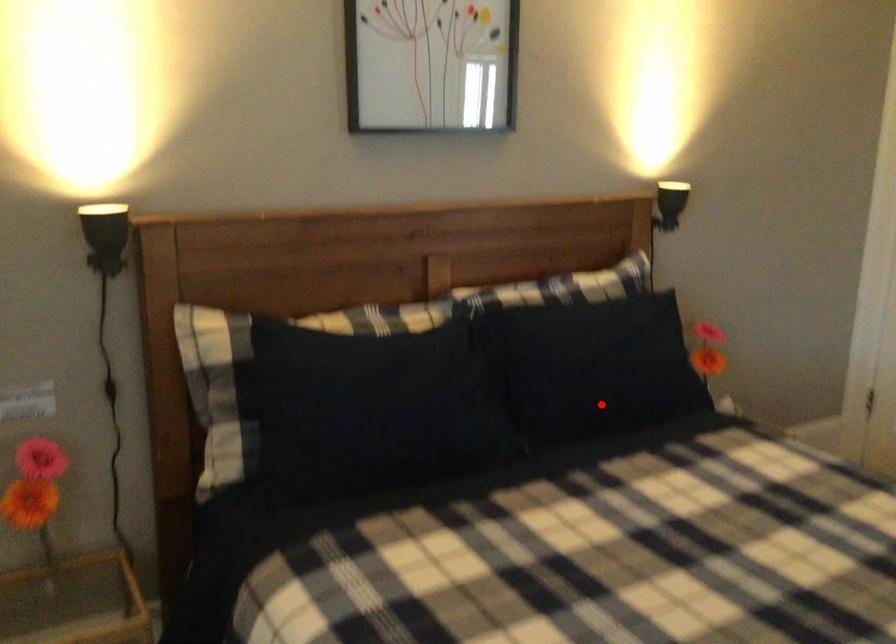
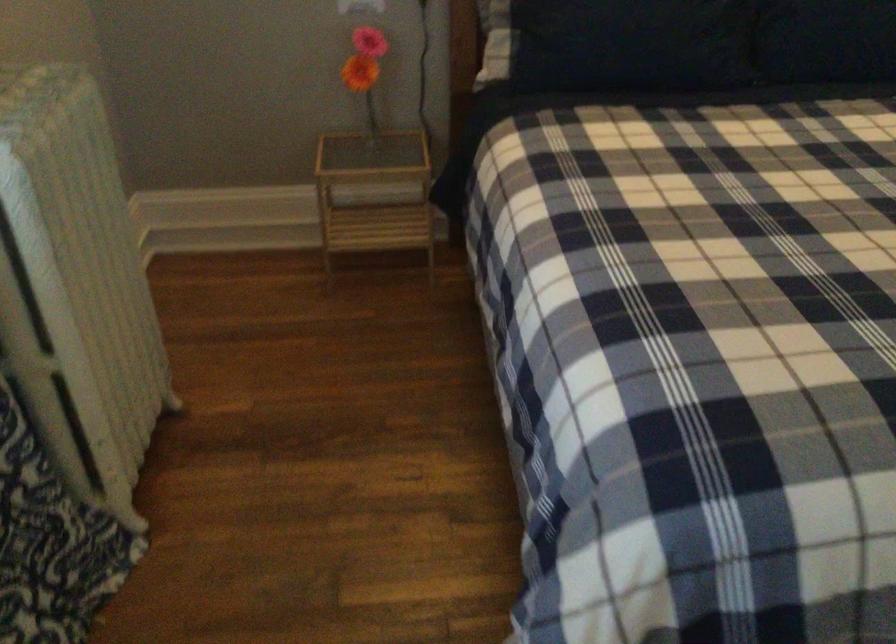
The point at the highlighted location is marked in the first image. Where is the corresponding point in the second image?

(830, 43)